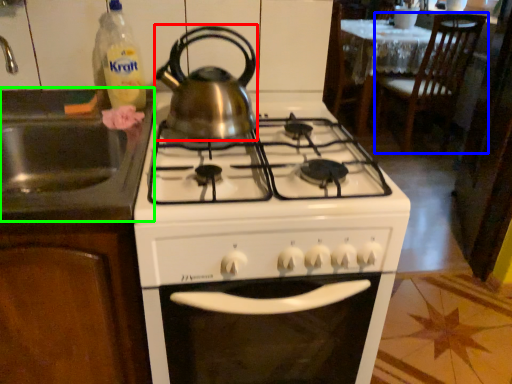
Question: Which object is positioned closest to kitchen appliance (highlighted by a red box)? Select from chair (highlighted by a blue box) and sink (highlighted by a green box).

Choices:
 (A) chair
 (B) sink

Answer: (B)